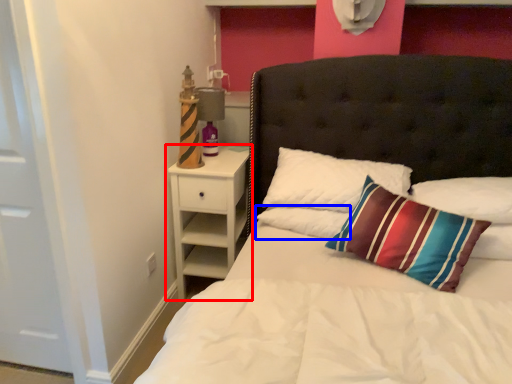
Question: Which object is further to the camera taking this photo, nightstand (highlighted by a red box) or pillow (highlighted by a blue box)?

Choices:
 (A) nightstand
 (B) pillow

Answer: (A)